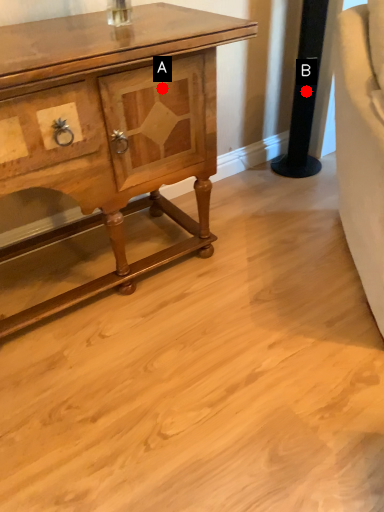
Question: Two points are circled on the image, labeled by A and B beside each circle. Which point appears farthest from the camera in this image?

Choices:
 (A) A is further
 (B) B is further

Answer: (B)